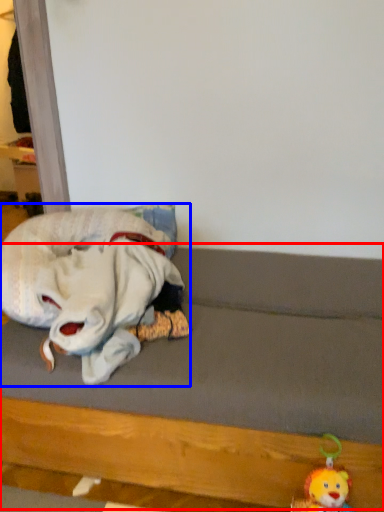
Question: Which object is closer to the camera taking this photo, bed frame (highlighted by a red box) or toy (highlighted by a blue box)?

Choices:
 (A) bed frame
 (B) toy

Answer: (A)